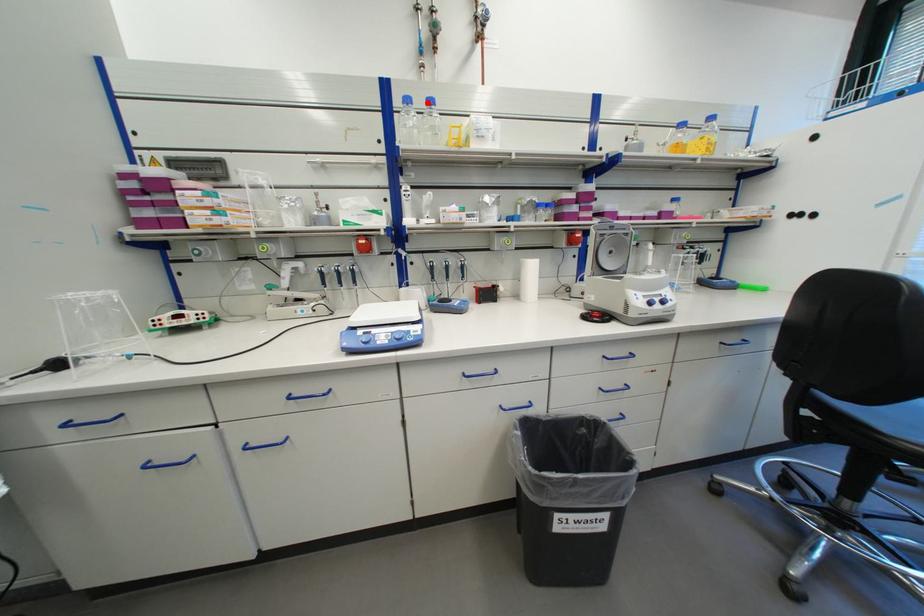
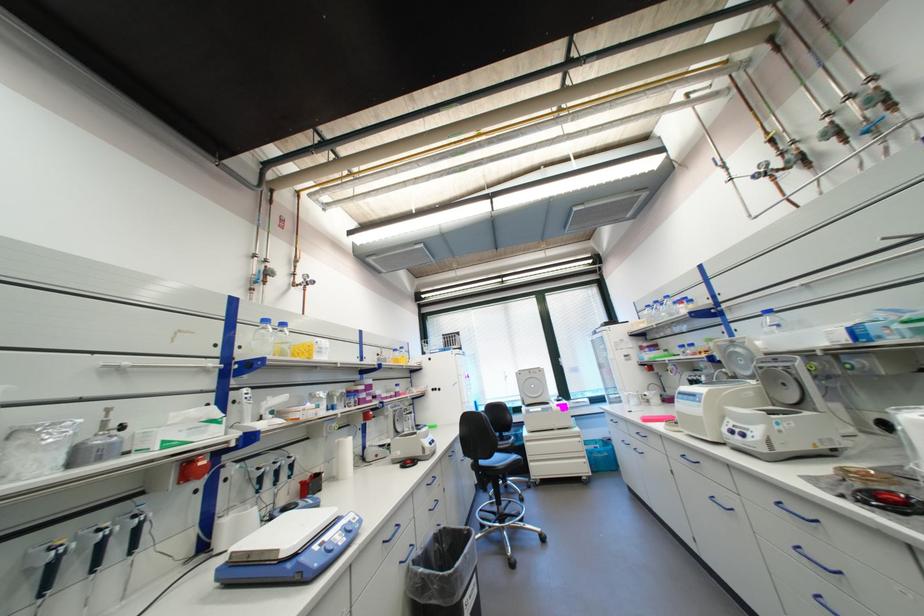
Question: I am providing you with two images of the same scene from different viewpoints. Image1 has a red point marked. In image2, the corresponding 3D location appears at what relative position? Reply with the corresponding letter.

Choices:
 (A) Closer
 (B) Farther

Answer: (B)